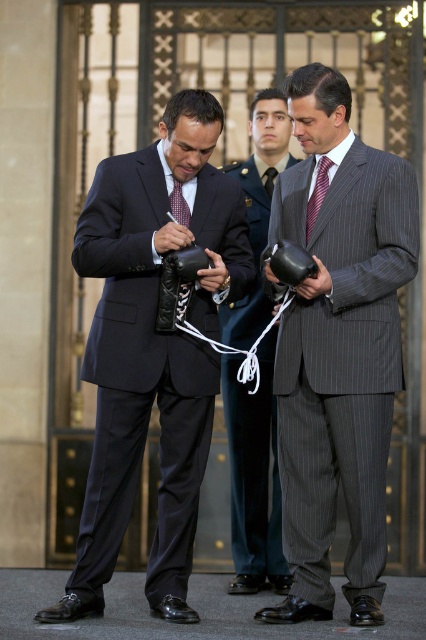
Does gray pinstripe suit at center have a greater width compared to striped silk tie at center?

Yes, gray pinstripe suit at center is wider than striped silk tie at center.

Which is in front, point (291, 483) or point (317, 189)?

Point (291, 483)

Is point (360, 289) closer to viewer compared to point (322, 166)?

Yes.

Where is `gray pinstripe suit at center`? gray pinstripe suit at center is located at coordinates (339, 348).

Does pinstriped suit at center have a lesser width compared to striped silk tie at center?

In fact, pinstriped suit at center might be wider than striped silk tie at center.

The image size is (426, 640). I want to click on pinstriped suit at center, so click(253, 476).

Is point (222, 337) positioned behind point (327, 176)?

Yes, point (222, 337) is behind point (327, 176).

Where is `pinstriped suit at center`? Image resolution: width=426 pixels, height=640 pixels. pinstriped suit at center is located at coordinates (253, 476).

Is gray pinstripe suit at center to the right of matte black suit at center from the viewer's perspective?

Correct, you'll find gray pinstripe suit at center to the right of matte black suit at center.

Between gray pinstripe suit at center and matte black suit at center, which one appears on the right side from the viewer's perspective?

gray pinstripe suit at center is more to the right.

What are the coordinates of `gray pinstripe suit at center` in the screenshot? It's located at (339, 348).

This screenshot has width=426, height=640. What are the coordinates of `gray pinstripe suit at center` in the screenshot? It's located at [x=339, y=348].